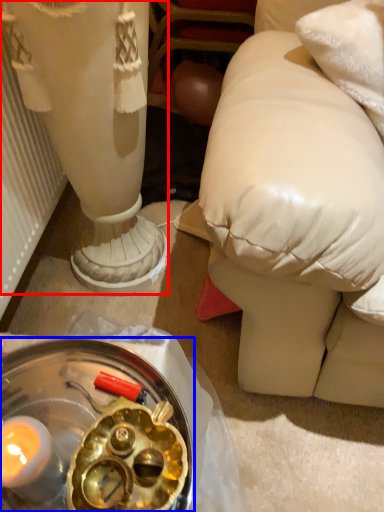
Question: Which point is further to the camera, sculpture (highlighted by a red box) or glass plate (highlighted by a blue box)?

Choices:
 (A) sculpture
 (B) glass plate

Answer: (A)